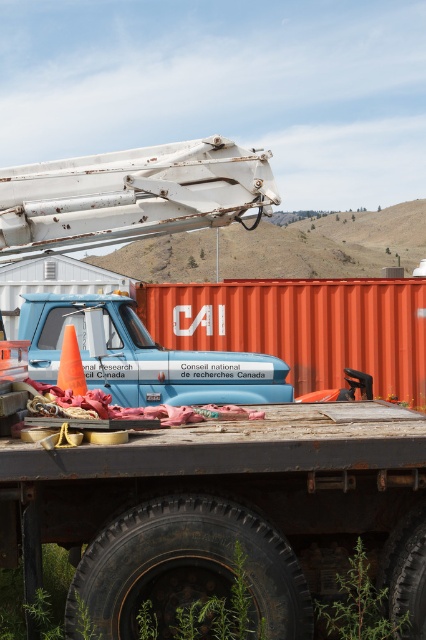
You are a delivery driver who needs to park your vehicle exactly 3 meters away from the orange matte traffic cone at lower left. Given the current position of the blue matte pickup truck at center, can you safely park your vehicle without overlapping with it?

The distance between the blue matte pickup truck at center and the orange matte traffic cone at lower left is 3.33 meters. Since you need to park exactly 3 meters away from the traffic cone, you can position your vehicle slightly closer to the cone while maintaining a safe distance from the truck.

You are standing in front of the blue utility truck with the telescopic boom. There are two points marked on the truck bed. The first point is at coordinate (279, 385) and the second is at (57, 380). If you were to walk towards the truck bed, which point would you encounter first?

Point at (279, 385) is closer to you, so you would encounter it first.